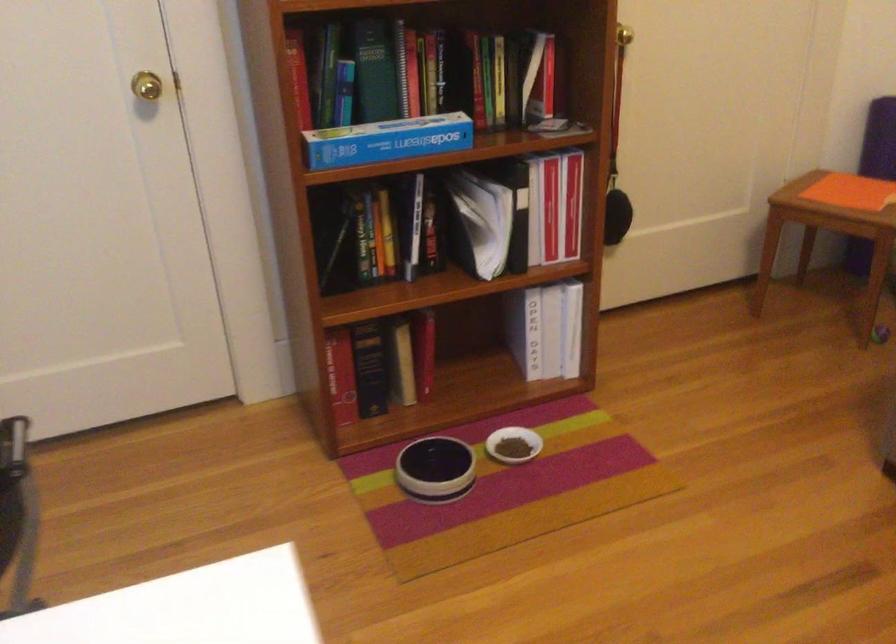
Find where to lift the black pouch. Please return your answer as a coordinate pair (x, y).

(616, 216)